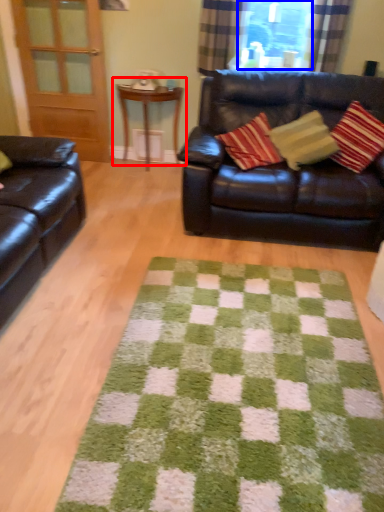
Question: Which object is further to the camera taking this photo, table (highlighted by a red box) or window screen (highlighted by a blue box)?

Choices:
 (A) table
 (B) window screen

Answer: (A)